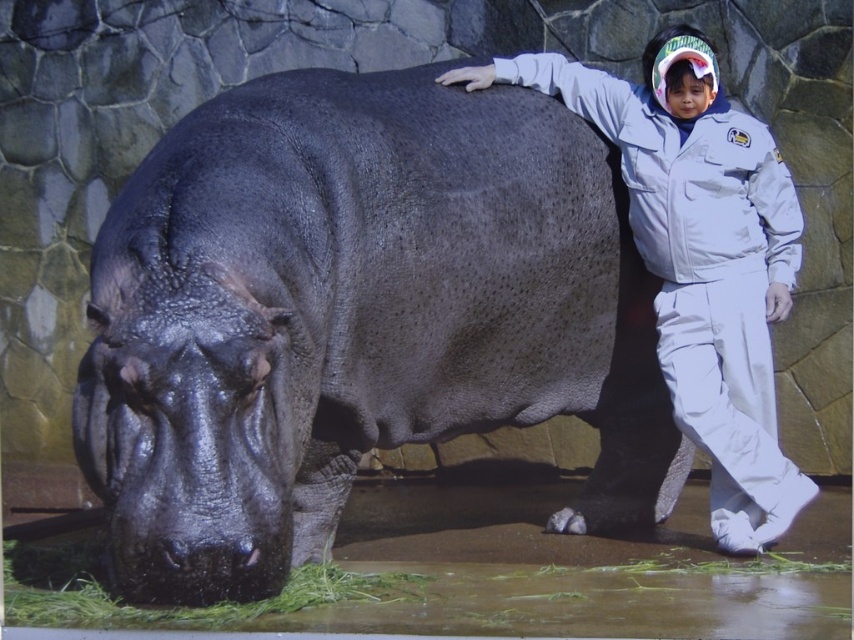
Question: Which of the following is the closest to the observer?

Choices:
 (A) (6, 611)
 (B) (609, 92)

Answer: (A)

Question: Can you confirm if white matte jacket at center is bigger than green leafy grass at lower left?

Choices:
 (A) yes
 (B) no

Answer: (A)

Question: Is shiny dark gray hippo at center bigger than white matte jacket at center?

Choices:
 (A) no
 (B) yes

Answer: (B)

Question: Which point appears closest to the camera in this image?

Choices:
 (A) (98, 593)
 (B) (395, 108)
 (C) (697, 230)

Answer: (A)

Question: Which object appears farthest from the camera in this image?

Choices:
 (A) shiny dark gray hippo at center
 (B) white matte jacket at center
 (C) green leafy grass at lower left

Answer: (B)

Question: Is the position of white matte jacket at center more distant than that of green leafy grass at lower left?

Choices:
 (A) yes
 (B) no

Answer: (A)